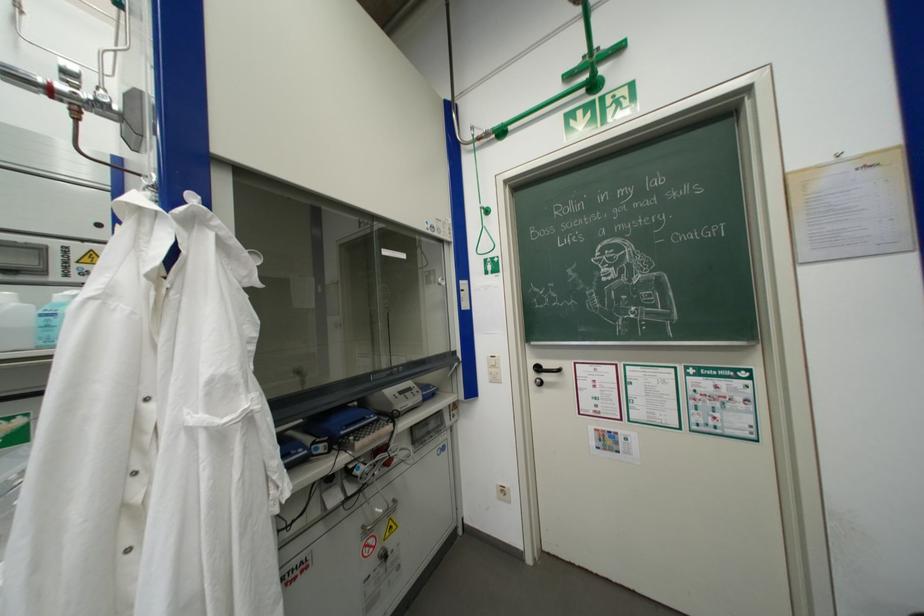
Where is `green pull handle`? The width and height of the screenshot is (924, 616). green pull handle is located at coordinates (518, 118).